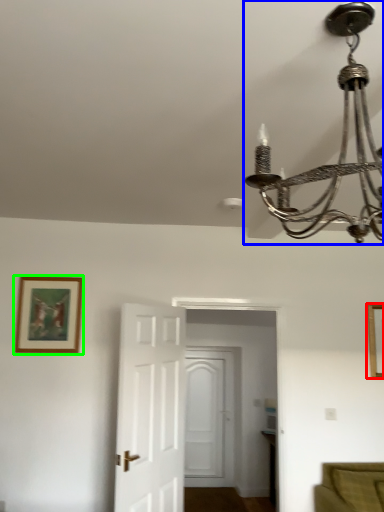
Question: Estimate the real-world distances between objects in this image. Which object is farther from picture frame (highlighted by a red box), lamp (highlighted by a blue box) or picture frame (highlighted by a green box)?

Choices:
 (A) lamp
 (B) picture frame

Answer: (A)